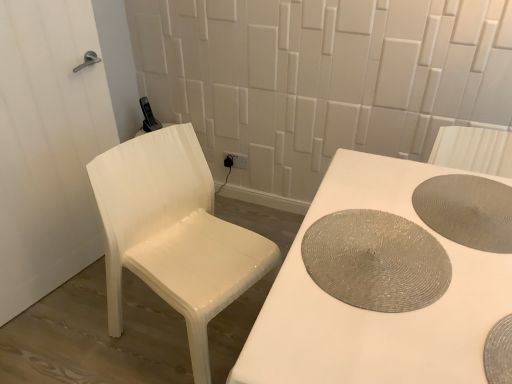
What are the coordinates of `vacant area on top of shiny metallic placemat at table right, arranged as the second manhole cover when viewed from the back (from a real-world perspective)` in the screenshot? It's located at (367, 249).